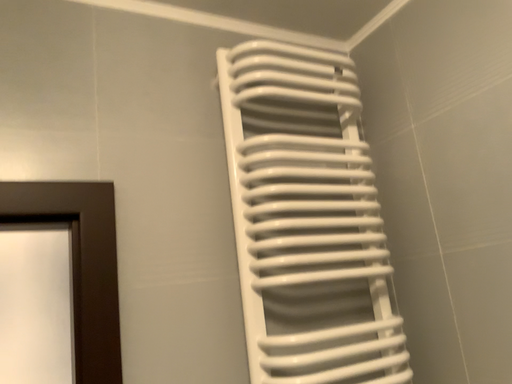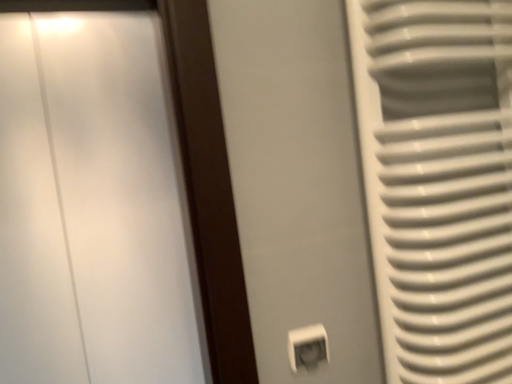
Question: Which way did the camera rotate in the video?

Choices:
 (A) rotated left
 (B) rotated right

Answer: (A)